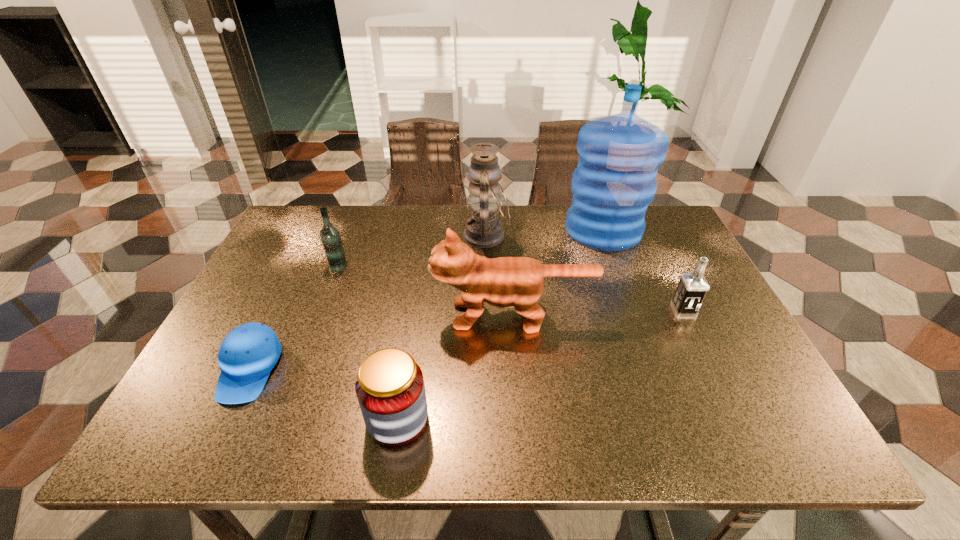
Find the location of `object at the near edge`. object at the near edge is located at coordinates (390, 389).

Identify the location of object situated at the left edge. pyautogui.click(x=249, y=352).

Find the location of `water jug present at the right edge`. water jug present at the right edge is located at coordinates (619, 155).

Identify the location of vodka that is at the right edge. The height and width of the screenshot is (540, 960). [692, 288].

Locate an element on the screen. The width and height of the screenshot is (960, 540). object that is at the far right corner is located at coordinates (619, 155).

In the image, there is a desktop. At what (x,y) coordinates should I click in order to perform the action: click on vacant area at the far edge. Please return your answer as a coordinate pair (x, y). Looking at the image, I should click on (408, 226).

Identify the location of free region at the near edge. (550, 449).

You are a GUI agent. You are given a task and a screenshot of the screen. Output one action in this format:
    pyautogui.click(x=<x>, y=<y>)
    Task: Click on the vacant space at the right edge of the desktop
    The image size is (960, 540).
    Given the screenshot: What is the action you would take?
    pyautogui.click(x=693, y=265)

Where is `free space at the far left corner of the desktop`? free space at the far left corner of the desktop is located at coordinates (289, 249).

Image resolution: width=960 pixels, height=540 pixels. I want to click on vacant space at the near left corner of the desktop, so click(x=198, y=416).